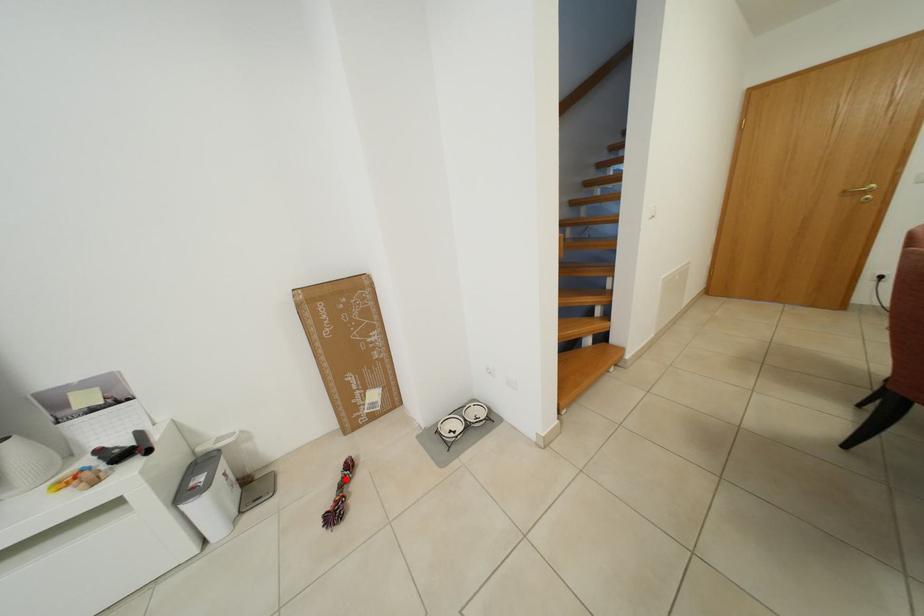
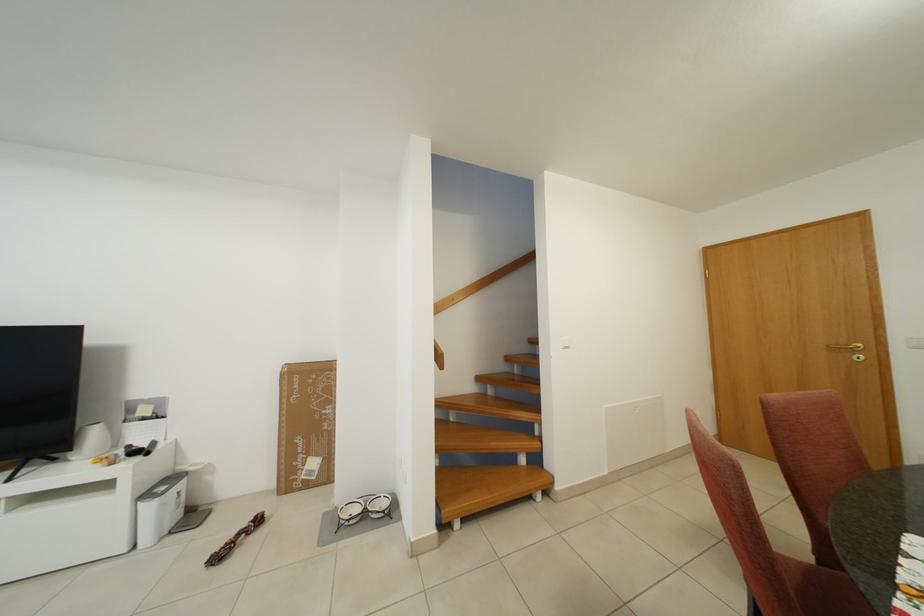
Question: I am providing you with two images of the same scene from different viewpoints. Image1 has a red point marked. In image2, the corresponding 3D location appears at what relative position? Reply with the corresponding letter.

Choices:
 (A) Closer
 (B) Farther

Answer: (B)